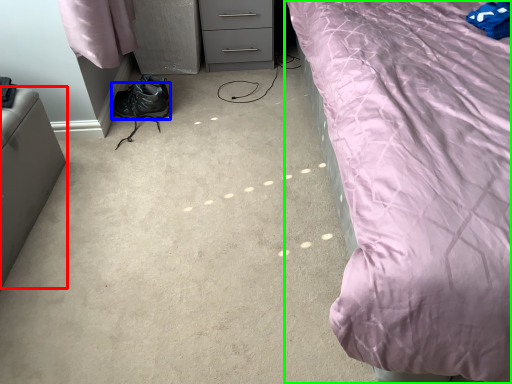
Question: Estimate the real-world distances between objects in this image. Which object is farther from furniture (highlighted by a red box), shoe (highlighted by a blue box) or bed (highlighted by a green box)?

Choices:
 (A) shoe
 (B) bed

Answer: (B)